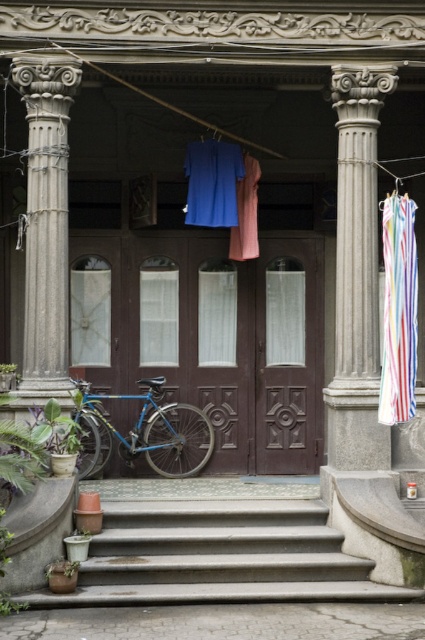
Is smooth concrete stairs at center further to camera compared to blue metallic bicycle at lower left?

No, smooth concrete stairs at center is in front of blue metallic bicycle at lower left.

Is smooth concrete stairs at center shorter than blue metallic bicycle at lower left?

Correct, smooth concrete stairs at center is not as tall as blue metallic bicycle at lower left.

Describe the element at coordinates (218, 556) in the screenshot. I see `smooth concrete stairs at center` at that location.

This screenshot has height=640, width=425. Identify the location of smooth concrete stairs at center. (218, 556).

Is point (45, 115) closer to camera compared to point (82, 470)?

Yes.

Between point (67, 346) and point (161, 461), which one is positioned behind?

Positioned behind is point (161, 461).

Who is more forward, (39, 140) or (142, 419)?

Positioned in front is point (39, 140).

The image size is (425, 640). I want to click on gray stone column at left, so pyautogui.click(x=45, y=230).

Does smooth concrete stairs at center appear on the left side of gray stone column at right?

Indeed, smooth concrete stairs at center is positioned on the left side of gray stone column at right.

Locate an element on the screen. Image resolution: width=425 pixels, height=640 pixels. smooth concrete stairs at center is located at coordinates (218, 556).

Measure the distance between smooth concrete stairs at center and camera.

smooth concrete stairs at center is 7.82 meters from camera.

Identify the location of smooth concrete stairs at center. The image size is (425, 640). [x=218, y=556].